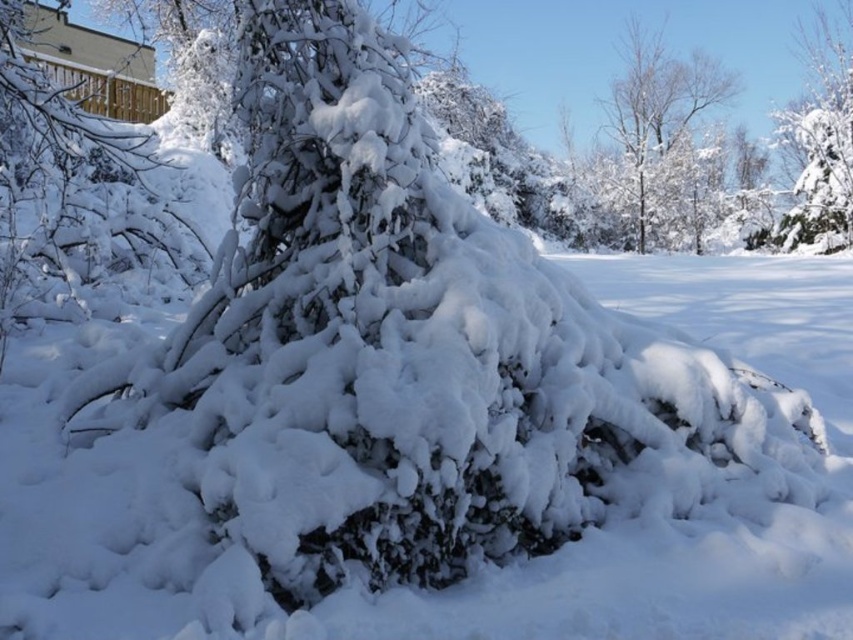
Question: Considering the relative positions of white snow-covered tree at upper right and white fluffy snow at upper right in the image provided, where is white snow-covered tree at upper right located with respect to white fluffy snow at upper right?

Choices:
 (A) left
 (B) right

Answer: (A)

Question: Considering the relative positions of white snow-covered tree at upper right and white fluffy snow at upper right in the image provided, where is white snow-covered tree at upper right located with respect to white fluffy snow at upper right?

Choices:
 (A) left
 (B) right

Answer: (A)

Question: Does white snow-covered tree at upper right have a lesser width compared to white fluffy snow at upper right?

Choices:
 (A) no
 (B) yes

Answer: (A)

Question: Which object appears farthest from the camera in this image?

Choices:
 (A) white fluffy snow at upper right
 (B) white snow-covered tree at upper right

Answer: (B)